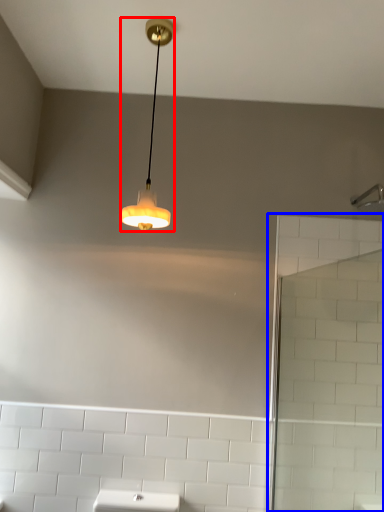
Question: Which object appears farthest to the camera in this image, lamp (highlighted by a red box) or screen door (highlighted by a blue box)?

Choices:
 (A) lamp
 (B) screen door

Answer: (A)